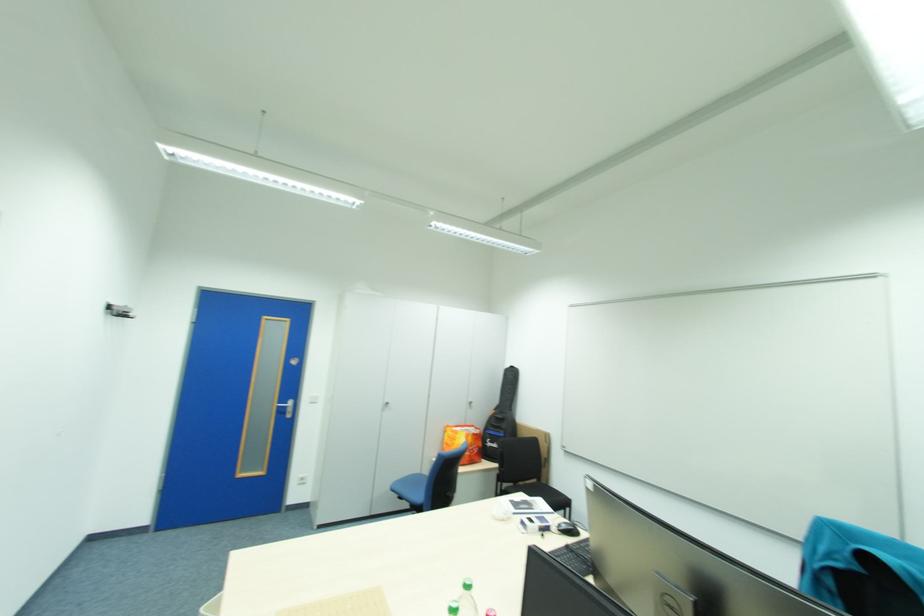
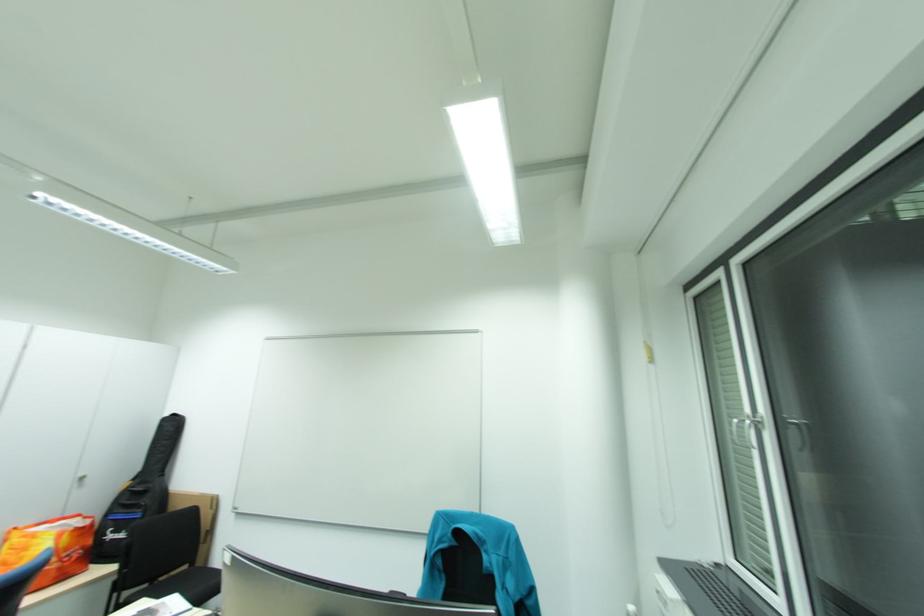
Where in the second image is the point corresponding to point 543,480 from the first image?

(193, 568)